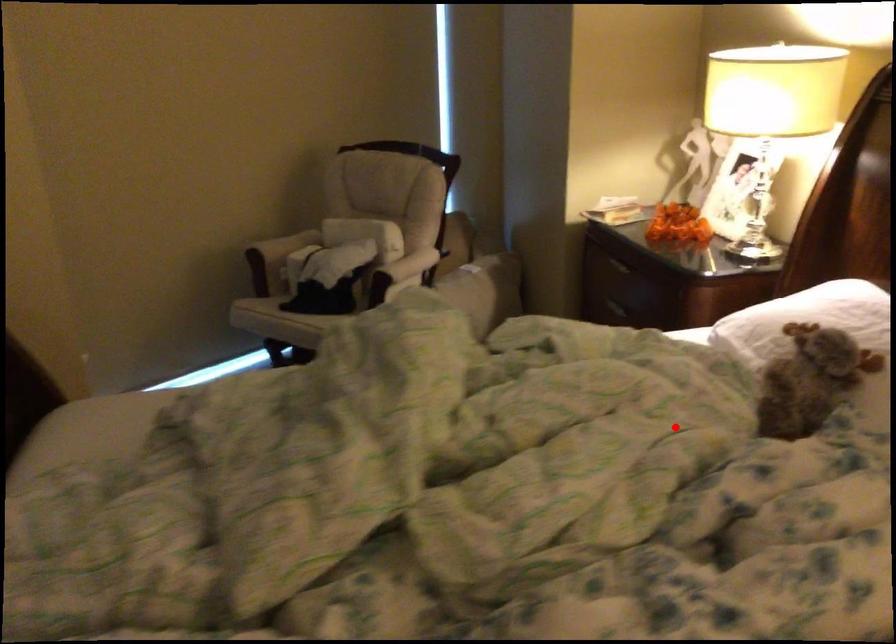
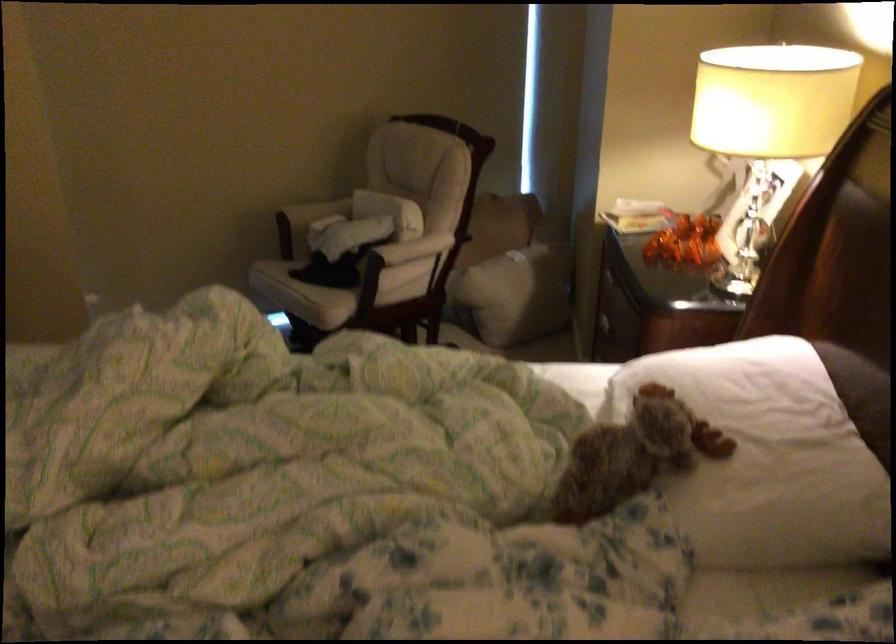
The point at the highlighted location is marked in the first image. Where is the corresponding point in the second image?

(373, 486)